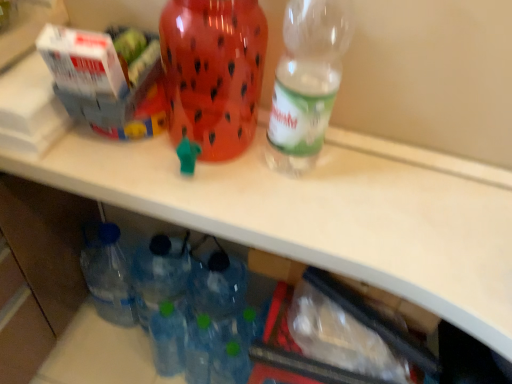
Image resolution: width=512 pixels, height=384 pixels. Describe the element at coordinates (307, 82) in the screenshot. I see `clear plastic bottle at upper right, positioned as the 1th bottle in right-to-left order` at that location.

This screenshot has height=384, width=512. Identify the location of translucent plastic water jug at center, which is counted as the 1th bottle, starting from the left. (213, 72).

Can you confirm if clear plastic bottle at upper right, positioned as the 1th bottle in right-to-left order, is shorter than white cardboard box at upper left, which is the first box from right to left?

Incorrect, the height of clear plastic bottle at upper right, positioned as the 1th bottle in right-to-left order, does not fall short of that of white cardboard box at upper left, which is the first box from right to left.

Which object is closer to the camera, clear plastic bottle at upper right, positioned as the 1th bottle in right-to-left order, or white cardboard box at upper left, which is the first box from right to left?

clear plastic bottle at upper right, positioned as the 1th bottle in right-to-left order, is in front.

From the image's perspective, is white cardboard box at upper left, which appears as the second box when viewed from the left, above translucent plastic water jug at center, which is counted as the 1th bottle, starting from the left?

Yes, from the image's perspective, white cardboard box at upper left, which appears as the second box when viewed from the left, is on top of translucent plastic water jug at center, which is counted as the 1th bottle, starting from the left.

Is white cardboard box at upper left, which is the first box from right to left, next to translucent plastic water jug at center, which is counted as the 1th bottle, starting from the left, and touching it?

white cardboard box at upper left, which is the first box from right to left, is not next to translucent plastic water jug at center, which is counted as the 1th bottle, starting from the left, and they're not touching.

Identify the location of the 1st bottle below the white cardboard box at upper left, which is the first box from right to left (from the image's perspective). The width and height of the screenshot is (512, 384). (213, 72).

Is white cardboard box at upper left, which appears as the second box when viewed from the left, positioned in front of translucent plastic water jug at center, the second bottle when ordered from right to left?

No, white cardboard box at upper left, which appears as the second box when viewed from the left, is behind translucent plastic water jug at center, the second bottle when ordered from right to left.

Considering the positions of points (10, 12) and (47, 41), is point (10, 12) closer to camera compared to point (47, 41)?

No, it is behind (47, 41).

Considering the relative positions of white cardboard box at upper left, the second box viewed from the right, and white cardboard box at upper left, which is the first box from right to left, in the image provided, is white cardboard box at upper left, the second box viewed from the right, in front of white cardboard box at upper left, which is the first box from right to left,?

Yes, it is.

From the picture: Does white cardboard box at upper left, the second box viewed from the right, have a lesser height compared to white cardboard box at upper left, which is the first box from right to left?

No.

Which is farther from the camera, (234, 11) or (150, 33)?

The point (150, 33) is more distant.

Considering the relative positions of translucent plastic water jug at center, which is counted as the 1th bottle, starting from the left, and white cardboard box at upper left, which is the first box from right to left, in the image provided, is translucent plastic water jug at center, which is counted as the 1th bottle, starting from the left, to the left of white cardboard box at upper left, which is the first box from right to left, from the viewer's perspective?

No.

How many degrees apart are the facing directions of translucent plastic water jug at center, the second bottle when ordered from right to left, and white cardboard box at upper left, which appears as the second box when viewed from the left?

The angle between the facing direction of translucent plastic water jug at center, the second bottle when ordered from right to left, and the facing direction of white cardboard box at upper left, which appears as the second box when viewed from the left, is 0.000112 degrees.

The image size is (512, 384). Find the location of `bottle that is the 1st object to the right of the white cardboard box at upper left, which appears as the second box when viewed from the left, starting at the anchor`. bottle that is the 1st object to the right of the white cardboard box at upper left, which appears as the second box when viewed from the left, starting at the anchor is located at coordinates (213, 72).

Which of these two, translucent plastic water jug at center, the second bottle when ordered from right to left, or white cardboard box at upper left, the second box viewed from the right, is thinner?

translucent plastic water jug at center, the second bottle when ordered from right to left, is thinner.

Image resolution: width=512 pixels, height=384 pixels. What are the coordinates of `box above the translucent plastic water jug at center, the second bottle when ordered from right to left (from a real-world perspective)` in the screenshot? It's located at (28, 27).

Could white cardboard box at upper left, the second box viewed from the right, be considered to be inside translucent plastic water jug at center, which is counted as the 1th bottle, starting from the left?

No, translucent plastic water jug at center, which is counted as the 1th bottle, starting from the left, does not contain white cardboard box at upper left, the second box viewed from the right.

Who is shorter, translucent plastic water jug at center, which is counted as the 1th bottle, starting from the left, or white cardboard box at upper left, the second box viewed from the right?

white cardboard box at upper left, the second box viewed from the right, is shorter.

Measure the distance between clear plastic bottle at upper right, positioned as the 1th bottle in right-to-left order, and translucent plastic water jug at center, which is counted as the 1th bottle, starting from the left.

clear plastic bottle at upper right, positioned as the 1th bottle in right-to-left order, is 4.53 inches away from translucent plastic water jug at center, which is counted as the 1th bottle, starting from the left.

In the scene shown: Can you see clear plastic bottle at upper right, positioned as the 1th bottle in right-to-left order, touching translucent plastic water jug at center, the second bottle when ordered from right to left?

No, clear plastic bottle at upper right, positioned as the 1th bottle in right-to-left order, is not making contact with translucent plastic water jug at center, the second bottle when ordered from right to left.

From the image's perspective, would you say clear plastic bottle at upper right, positioned as the 1th bottle in right-to-left order, is shown under translucent plastic water jug at center, the second bottle when ordered from right to left?

Yes, from the image's perspective, clear plastic bottle at upper right, positioned as the 1th bottle in right-to-left order, is beneath translucent plastic water jug at center, the second bottle when ordered from right to left.

Between white cardboard box at upper left, which is the first box from right to left, and white cardboard box at upper left, the second box viewed from the right, which one has smaller size?

white cardboard box at upper left, which is the first box from right to left.

How many degrees apart are the facing directions of white cardboard box at upper left, which is the first box from right to left, and white cardboard box at upper left, the first box from the left?

The angular difference between white cardboard box at upper left, which is the first box from right to left, and white cardboard box at upper left, the first box from the left, is 90 degrees.

Between white cardboard box at upper left, which appears as the second box when viewed from the left, and white cardboard box at upper left, the first box from the left, which one appears on the right side from the viewer's perspective?

Positioned to the right is white cardboard box at upper left, which appears as the second box when viewed from the left.

The image size is (512, 384). Find the location of `the 2nd box behind the clear plastic bottle at upper right, positioned as the 1th bottle in right-to-left order, counting from the anchor's position`. the 2nd box behind the clear plastic bottle at upper right, positioned as the 1th bottle in right-to-left order, counting from the anchor's position is located at coordinates (109, 80).

Identify the location of the 1st bottle positioned below the white cardboard box at upper left, which is the first box from right to left (from the image's perspective). (213, 72).

From the image, which object appears to be farther from white cardboard box at upper left, which is the first box from right to left, clear plastic bottle at upper right, positioned as the 1th bottle in right-to-left order, or translucent plastic water jug at center, the second bottle when ordered from right to left?

clear plastic bottle at upper right, positioned as the 1th bottle in right-to-left order, lies further to white cardboard box at upper left, which is the first box from right to left, than the other object.

Based on their spatial positions, is clear plastic bottle at upper right, positioned as the 1th bottle in right-to-left order, or white cardboard box at upper left, the second box viewed from the right, closer to translucent plastic water jug at center, the second bottle when ordered from right to left?

Based on the image, clear plastic bottle at upper right, positioned as the 1th bottle in right-to-left order, appears to be nearer to translucent plastic water jug at center, the second bottle when ordered from right to left.

Considering their positions, is translucent plastic water jug at center, the second bottle when ordered from right to left, positioned further to clear plastic bottle at upper right, positioned as the 1th bottle in right-to-left order, than white cardboard box at upper left, which is the first box from right to left?

white cardboard box at upper left, which is the first box from right to left.

Which object lies further to the anchor point white cardboard box at upper left, which is the first box from right to left, clear plastic bottle at upper right, positioned as the 1th bottle in right-to-left order, or white cardboard box at upper left, the second box viewed from the right?

clear plastic bottle at upper right, positioned as the 1th bottle in right-to-left order, is positioned further to the anchor white cardboard box at upper left, which is the first box from right to left.

When comparing their distances from white cardboard box at upper left, the second box viewed from the right, does clear plastic bottle at upper right, which is counted as the 2th bottle, starting from the left, or translucent plastic water jug at center, the second bottle when ordered from right to left, seem further?

The object further to white cardboard box at upper left, the second box viewed from the right, is clear plastic bottle at upper right, which is counted as the 2th bottle, starting from the left.

Estimate the real-world distances between objects in this image. Which object is closer to clear plastic bottle at upper right, positioned as the 1th bottle in right-to-left order, white cardboard box at upper left, the second box viewed from the right, or translucent plastic water jug at center, the second bottle when ordered from right to left?

translucent plastic water jug at center, the second bottle when ordered from right to left, is positioned closer to the anchor clear plastic bottle at upper right, positioned as the 1th bottle in right-to-left order.

From the image, which object appears to be farther from translucent plastic water jug at center, the second bottle when ordered from right to left, white cardboard box at upper left, which appears as the second box when viewed from the left, or white cardboard box at upper left, the first box from the left?

Based on the image, white cardboard box at upper left, the first box from the left, appears to be further to translucent plastic water jug at center, the second bottle when ordered from right to left.

Estimate the real-world distances between objects in this image. Which object is closer to white cardboard box at upper left, the first box from the left, translucent plastic water jug at center, the second bottle when ordered from right to left, or white cardboard box at upper left, which appears as the second box when viewed from the left?

Based on the image, white cardboard box at upper left, which appears as the second box when viewed from the left, appears to be nearer to white cardboard box at upper left, the first box from the left.

You are a GUI agent. You are given a task and a screenshot of the screen. Output one action in this format:
    pyautogui.click(x=<x>, y=<y>)
    Task: Click on the bottle between white cardboard box at upper left, the second box viewed from the right, and clear plastic bottle at upper right, positioned as the 1th bottle in right-to-left order
    The height and width of the screenshot is (384, 512).
    Given the screenshot: What is the action you would take?
    point(213,72)

I want to click on bottle situated between white cardboard box at upper left, which appears as the second box when viewed from the left, and clear plastic bottle at upper right, positioned as the 1th bottle in right-to-left order, from left to right, so click(x=213, y=72).

Where is `box between white cardboard box at upper left, the second box viewed from the right, and translucent plastic water jug at center, which is counted as the 1th bottle, starting from the left`? This screenshot has width=512, height=384. box between white cardboard box at upper left, the second box viewed from the right, and translucent plastic water jug at center, which is counted as the 1th bottle, starting from the left is located at coordinates (109, 80).

This screenshot has width=512, height=384. In order to click on box located between white cardboard box at upper left, the second box viewed from the right, and clear plastic bottle at upper right, positioned as the 1th bottle in right-to-left order, in the left-right direction in this screenshot , I will do `click(109, 80)`.